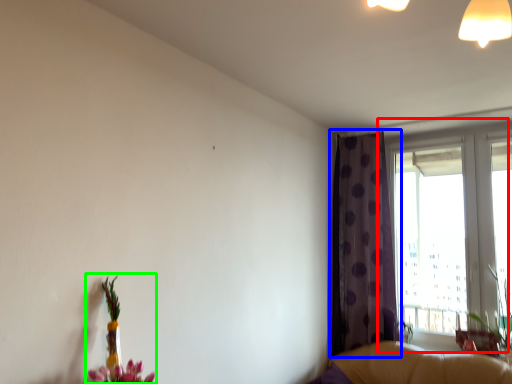
Question: Estimate the real-world distances between objects in this image. Which object is farther from window (highlighted by a red box), curtain (highlighted by a blue box) or floral arrangement (highlighted by a green box)?

Choices:
 (A) curtain
 (B) floral arrangement

Answer: (B)